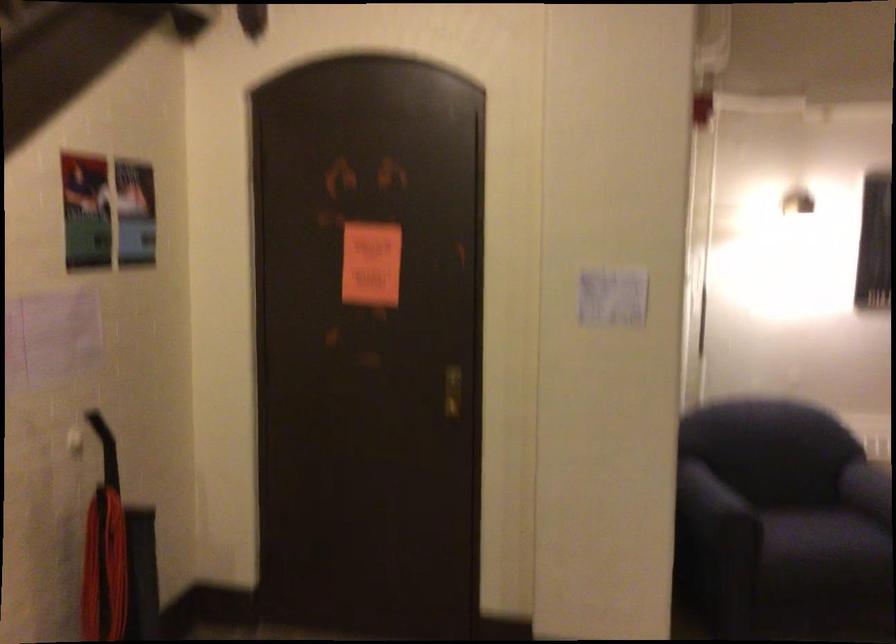
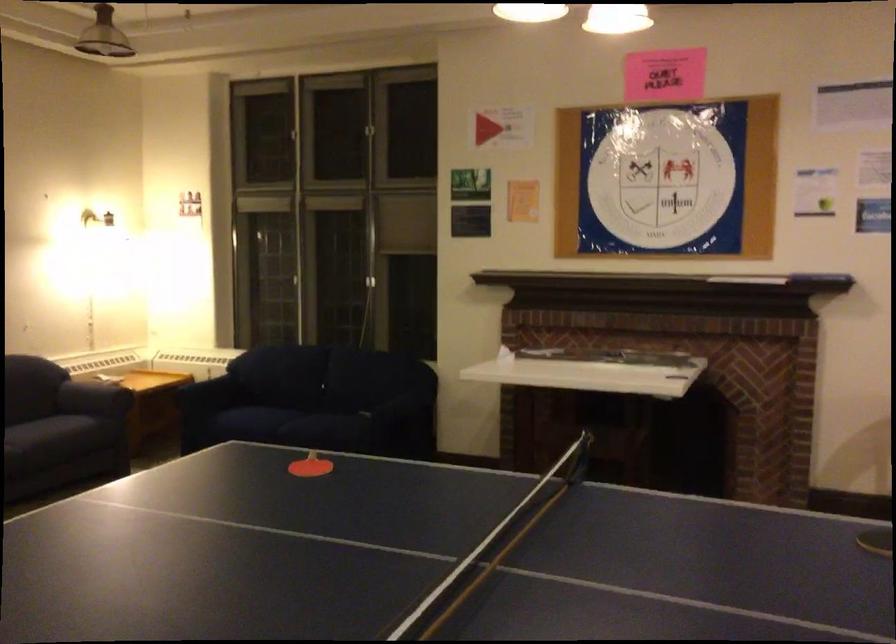
Question: The camera is either moving clockwise (left) or counter-clockwise (right) around the object. The first image is from the beginning of the video and the second image is from the end. Is the camera moving left or right when shooting the video?

Choices:
 (A) Left
 (B) Right

Answer: (A)